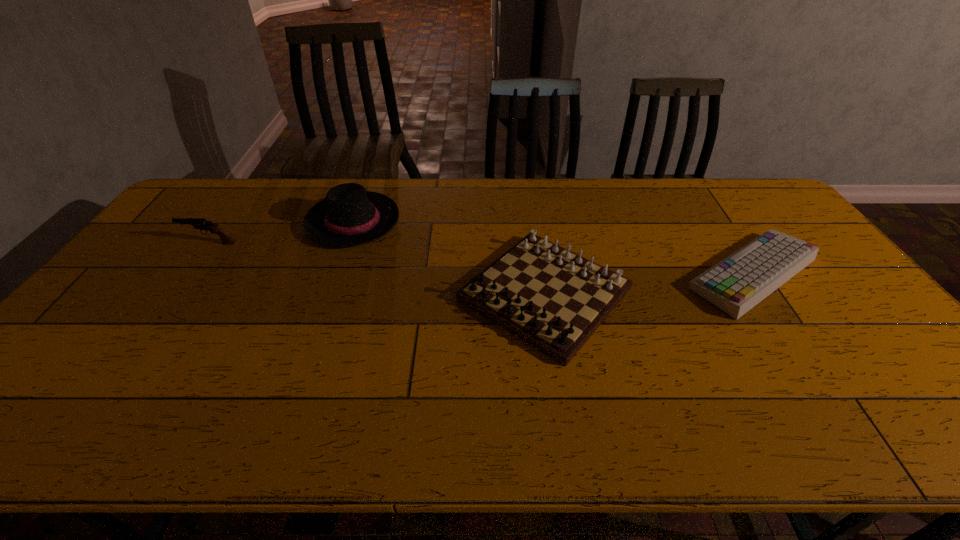
Locate an element on the screen. This screenshot has height=540, width=960. dress hat is located at coordinates (349, 216).

Locate an element on the screen. gun is located at coordinates (198, 223).

Identify the location of the third object from left to right. Image resolution: width=960 pixels, height=540 pixels. (553, 299).

Identify the location of chessboard. This screenshot has height=540, width=960. (553, 299).

The image size is (960, 540). What are the coordinates of `the shortest object` in the screenshot? It's located at (739, 282).

The image size is (960, 540). What are the coordinates of `computer keyboard` in the screenshot? It's located at (739, 282).

This screenshot has width=960, height=540. I want to click on free space located on the front of the third object from right to left, so click(333, 278).

Find the location of a particular element. free space located on the right of the second shortest object is located at coordinates (684, 294).

At what (x,y) coordinates should I click in order to perform the action: click on free spot located 0.120m on the back of the shortest object. Please return your answer as a coordinate pair (x, y). This screenshot has height=540, width=960. Looking at the image, I should click on (713, 214).

In order to click on object that is at the far edge in this screenshot , I will do `click(349, 216)`.